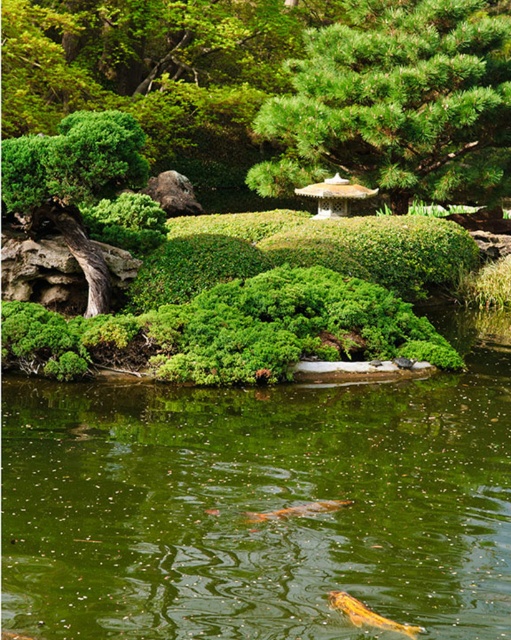
Question: Can you confirm if green textured tree at upper center is smaller than green leafy bush at left?

Choices:
 (A) yes
 (B) no

Answer: (B)

Question: Does shiny orange fish at lower center appear under orange glossy fish at center?

Choices:
 (A) no
 (B) yes

Answer: (B)

Question: Does green textured tree at upper center have a lesser width compared to shiny orange fish at lower center?

Choices:
 (A) yes
 (B) no

Answer: (B)

Question: Among these points, which one is farthest from the camera?

Choices:
 (A) (144, 564)
 (B) (335, 502)

Answer: (B)

Question: Which object is closer to the camera taking this photo?

Choices:
 (A) shiny orange fish at lower center
 (B) orange glossy fish at center
 (C) green textured tree at upper center
 (D) green glossy water at center

Answer: (A)

Question: Which point is farther from the camera taking this photo?

Choices:
 (A) (78, 241)
 (B) (280, 513)

Answer: (A)